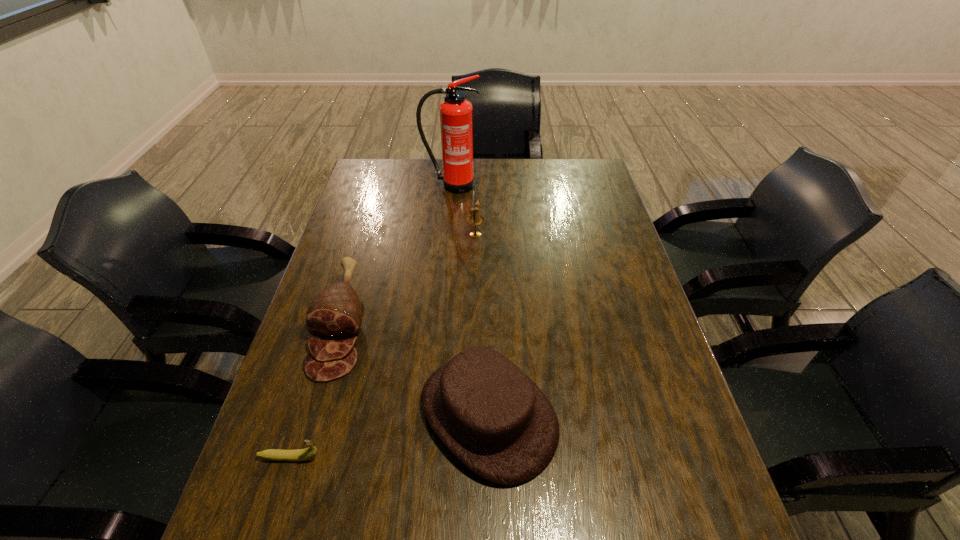
Locate an element on the screen. This screenshot has width=960, height=540. vacant space situated at the stem of the banana is located at coordinates (398, 457).

Locate an element on the screen. object located at the far edge is located at coordinates (456, 113).

Locate an element on the screen. ham positioned at the left edge is located at coordinates (336, 313).

I want to click on banana that is at the left edge, so click(x=271, y=454).

Locate an element on the screen. This screenshot has height=540, width=960. blank space at the far edge of the desktop is located at coordinates tap(426, 174).

The width and height of the screenshot is (960, 540). I want to click on vacant space at the left edge of the desktop, so click(x=347, y=240).

You are a GUI agent. You are given a task and a screenshot of the screen. Output one action in this format:
    pyautogui.click(x=<x>, y=<y>)
    Task: Click on the free space at the right edge of the desktop
    The image size is (960, 540).
    Given the screenshot: What is the action you would take?
    pyautogui.click(x=596, y=258)

Image resolution: width=960 pixels, height=540 pixels. Identify the location of vacant region at the far left corner. (384, 167).

Identify the location of blank region between the banana and the fire extinguisher. (371, 321).

Locate an element on the screen. This screenshot has height=540, width=960. vacant space in between the banana and the fire extinguisher is located at coordinates (371, 321).